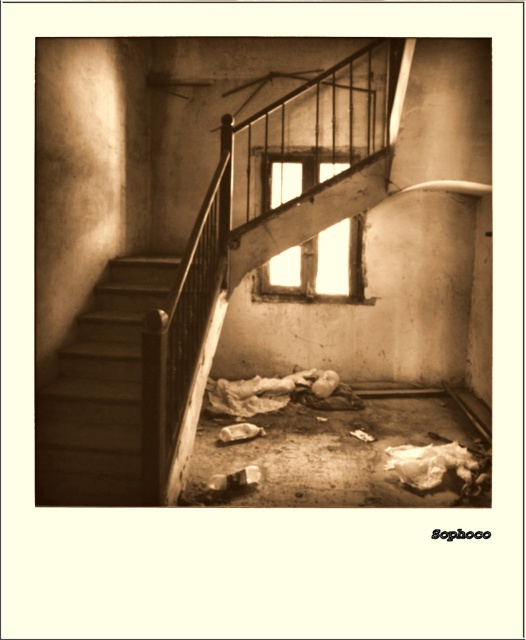
Who is taller, smooth wooden stairs at left or translucent glass window at center?

With more height is smooth wooden stairs at left.

Is point (157, 262) positioned in front of point (317, 150)?

That is True.

At what (x,y) coordinates should I click in order to perform the action: click on smooth wooden stairs at left. Please return your answer as a coordinate pair (x, y). The width and height of the screenshot is (526, 640). Looking at the image, I should click on (99, 392).